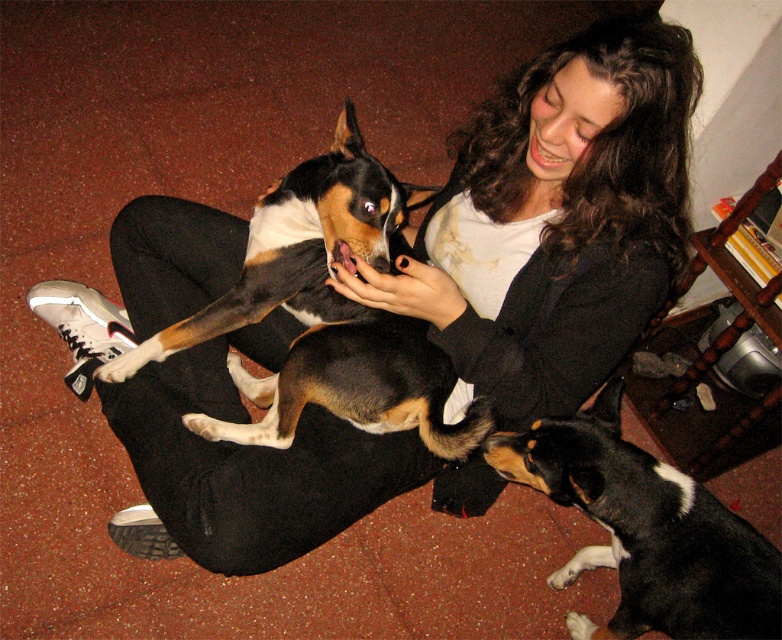
Question: Where is brown and white fur at center located in relation to black and tan fur at center in the image?

Choices:
 (A) below
 (B) above

Answer: (B)

Question: Does brown and white fur at center come in front of black and tan fur at center?

Choices:
 (A) no
 (B) yes

Answer: (A)

Question: Does brown and white fur at center lie in front of black and tan fur at center?

Choices:
 (A) no
 (B) yes

Answer: (A)

Question: Which point is closer to the camera taking this photo?

Choices:
 (A) (698, 627)
 (B) (318, 224)

Answer: (A)

Question: Which object is farther from the camera taking this photo?

Choices:
 (A) brown and white fur at center
 (B) black and tan fur at center

Answer: (A)